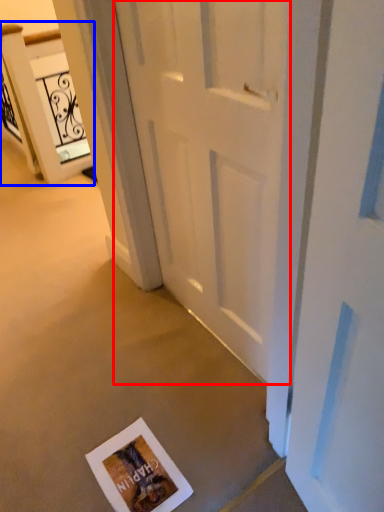
Question: Which object appears closest to the camera in this image, door (highlighted by a red box) or elevator (highlighted by a blue box)?

Choices:
 (A) door
 (B) elevator

Answer: (A)